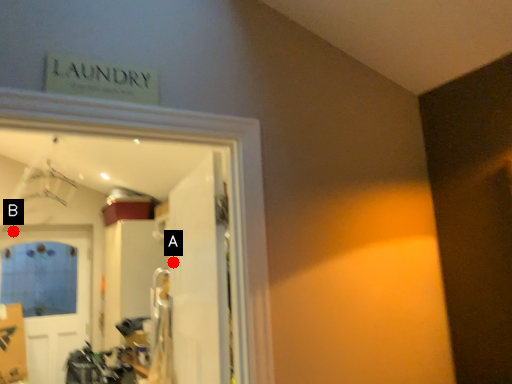
Question: Two points are circled on the image, labeled by A and B beside each circle. Which point is closer to the camera taking this photo?

Choices:
 (A) A is closer
 (B) B is closer

Answer: (A)